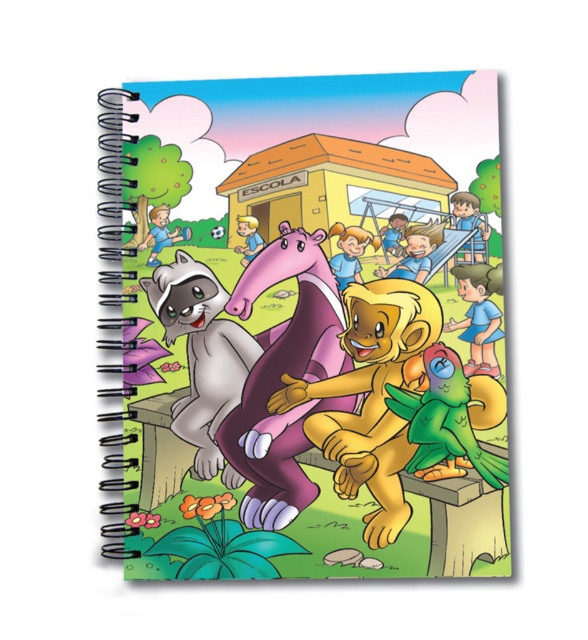
Based on the scene described, which animal is positioned higher up between the purple matte hippo at center and the yellow matte lion at center?

The purple matte hippo at center is positioned above the yellow matte lion at center.

You are standing at the center of the schoolyard looking towards the fence where the raccoon and dinosaur are sitting. There are two points marked on the notebook cover image. The first point is at coordinate (375, 532) and the second is at (215, 289). Which point is closer to you?

Point (375, 532) is in front of point (215, 289), so the first point is closer to you.